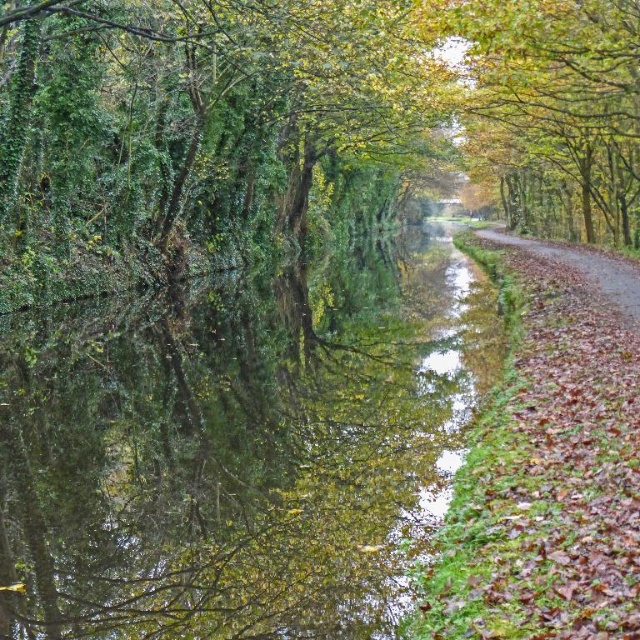
You are standing on the path beside the canal and want to take a photo of both the point at coordinates (627, 172) and the point at coordinates (628, 296). Which point should you focus on first to ensure both are in sharp focus?

You should focus on the point at coordinates (627, 172) first because it is closer to the camera than the point at coordinates (628, 296). This ensures both points will be in focus as the depth of field will cover both when focusing on the closer point.